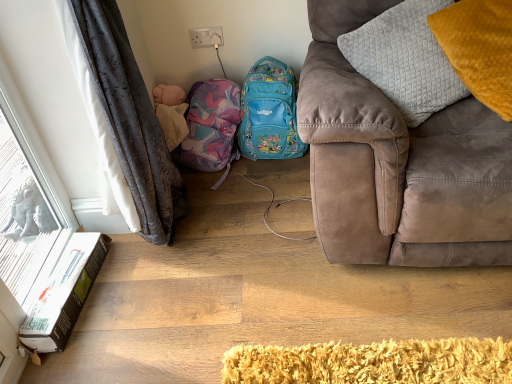
Question: Is suede couch at right taller than matte purple backpack at center?

Choices:
 (A) yes
 (B) no

Answer: (A)

Question: Does suede couch at right have a greater width compared to matte purple backpack at center?

Choices:
 (A) no
 (B) yes

Answer: (B)

Question: From the image's perspective, is suede couch at right on matte purple backpack at center?

Choices:
 (A) yes
 (B) no

Answer: (A)

Question: From a real-world perspective, is suede couch at right located beneath matte purple backpack at center?

Choices:
 (A) no
 (B) yes

Answer: (A)

Question: Is suede couch at right facing towards matte purple backpack at center?

Choices:
 (A) yes
 (B) no

Answer: (B)

Question: Is suede couch at right turned away from matte purple backpack at center?

Choices:
 (A) no
 (B) yes

Answer: (A)

Question: Is matte blue backpack at center at the right side of matte purple backpack at center?

Choices:
 (A) yes
 (B) no

Answer: (A)

Question: Can you see matte blue backpack at center touching matte purple backpack at center?

Choices:
 (A) no
 (B) yes

Answer: (A)

Question: Is the depth of matte blue backpack at center greater than that of matte purple backpack at center?

Choices:
 (A) yes
 (B) no

Answer: (B)

Question: From the image's perspective, is matte blue backpack at center over matte purple backpack at center?

Choices:
 (A) yes
 (B) no

Answer: (A)

Question: From a real-world perspective, is matte blue backpack at center below matte purple backpack at center?

Choices:
 (A) no
 (B) yes

Answer: (A)

Question: Considering the relative sizes of matte blue backpack at center and matte purple backpack at center in the image provided, is matte blue backpack at center wider than matte purple backpack at center?

Choices:
 (A) yes
 (B) no

Answer: (B)

Question: Is white cardboard box at lower left positioned in front of quilted gray pillow at upper right, the first pillow positioned from the left?

Choices:
 (A) no
 (B) yes

Answer: (A)